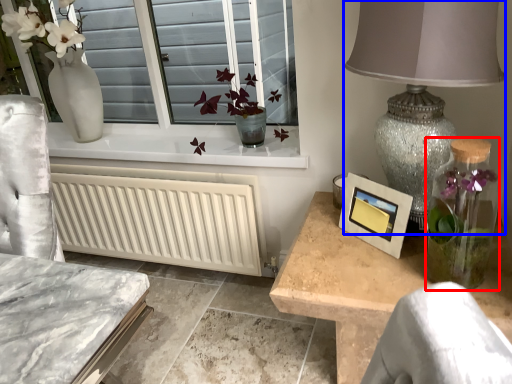
Question: Which of the following is the closest to the observer, glass vase (highlighted by a red box) or table lamp (highlighted by a blue box)?

Choices:
 (A) glass vase
 (B) table lamp

Answer: (B)